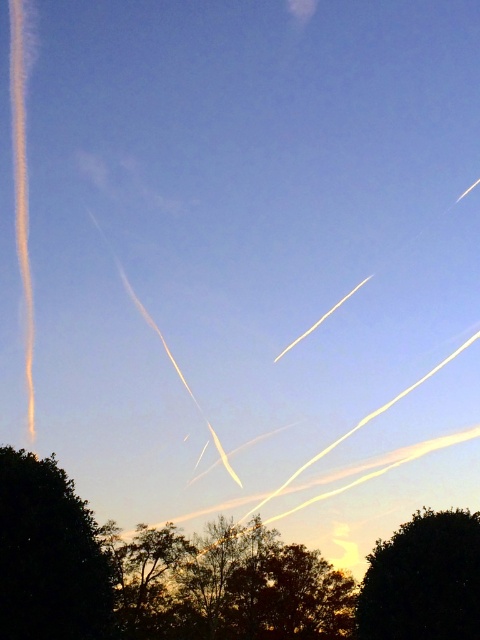
Question: Among these points, which one is farthest from the camera?

Choices:
 (A) (127, 592)
 (B) (39, 474)
 (C) (394, 573)
 (D) (254, 529)

Answer: (D)

Question: Based on their relative distances, which object is farther from the green leafy tree at lower center?

Choices:
 (A) green leafy tree at lower right
 (B) dark green leafy tree at lower left
 (C) brown textured tree at center

Answer: (A)

Question: Can you confirm if dark green leafy tree at lower left is wider than brown textured tree at center?

Choices:
 (A) yes
 (B) no

Answer: (B)

Question: Which point is closer to the camera?

Choices:
 (A) (168, 563)
 (B) (55, 520)

Answer: (B)

Question: Is green leafy tree at lower center thinner than dark green leafy tree at lower left?

Choices:
 (A) no
 (B) yes

Answer: (A)

Question: Observing the image, what is the correct spatial positioning of green leafy tree at lower center in reference to dark green leafy tree at lower left?

Choices:
 (A) below
 (B) above

Answer: (A)